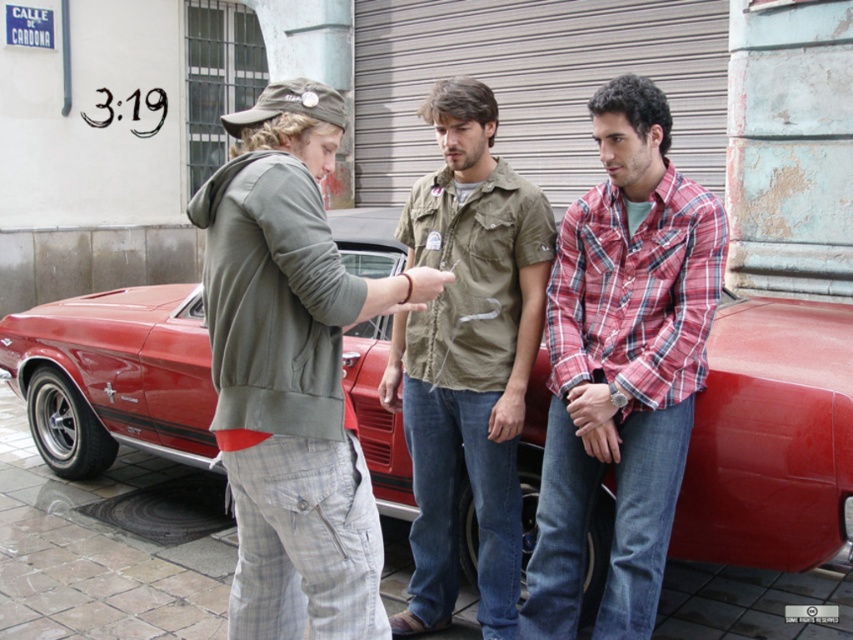
Question: Which of the following is the closest to the observer?

Choices:
 (A) (439, 356)
 (B) (634, 404)

Answer: (B)

Question: Does plaid cotton shirt at right come behind khaki cotton shirt at center?

Choices:
 (A) no
 (B) yes

Answer: (A)

Question: Which point is closer to the camera?

Choices:
 (A) (547, 250)
 (B) (757, 420)

Answer: (B)

Question: Estimate the real-world distances between objects in this image. Which object is farther from the plaid cotton shirt at right?

Choices:
 (A) shiny red car at center
 (B) khaki cotton shirt at center

Answer: (A)

Question: Where is plaid cotton shirt at right located in relation to khaki cotton shirt at center in the image?

Choices:
 (A) right
 (B) left

Answer: (A)

Question: Is shiny red car at center to the right of khaki cotton shirt at center from the viewer's perspective?

Choices:
 (A) yes
 (B) no

Answer: (B)